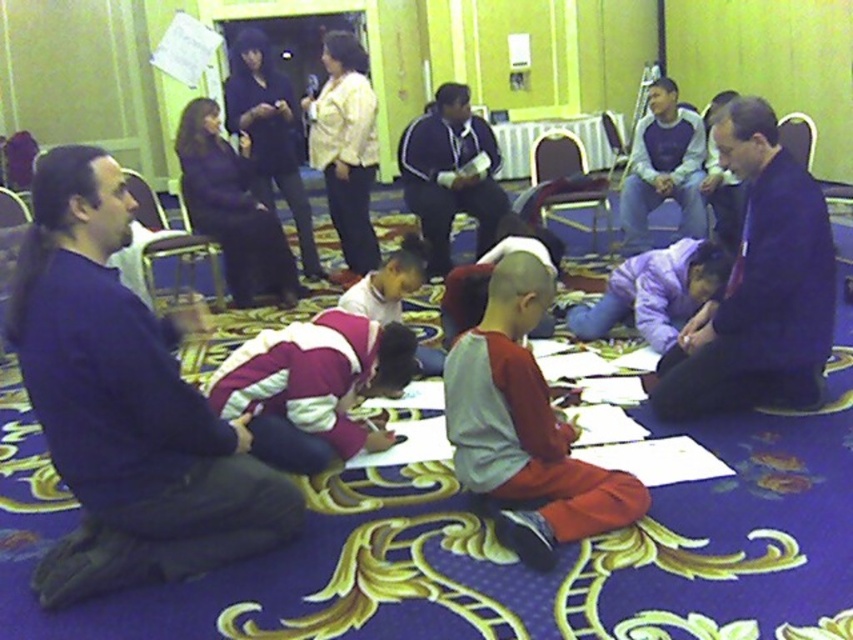
You are a participant in the drawing activity and want to place a small notebook on the floor between the dark blue fabric at center and the maroon fleece jacket at center. Can you do this without moving either object?

The dark blue fabric at center is above the maroon fleece jacket at center, so there is space between them on the floor. You can place the notebook there without moving either object.

You are a photographer trying to capture a candid shot of the participants in the drawing activity. You notice the purple fleece jacket at center and the gray sweatshirt at center. Which clothing item would block your view less if you position yourself behind them?

The purple fleece jacket at center is shorter than the gray sweatshirt at center, so positioning yourself behind them would result in the purple fleece jacket at center blocking your view less than the gray sweatshirt at center.

You are an observer in the room. You see the dark blue fabric at center and the dark blue shirt at center. Which one is located to the right of the other?

The dark blue fabric at center is positioned on the right side of dark blue shirt at center.